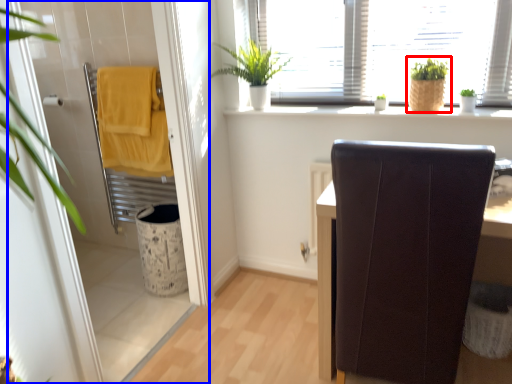
Question: Among these objects, which one is farthest to the camera, houseplant (highlighted by a red box) or screen door (highlighted by a blue box)?

Choices:
 (A) houseplant
 (B) screen door

Answer: (A)